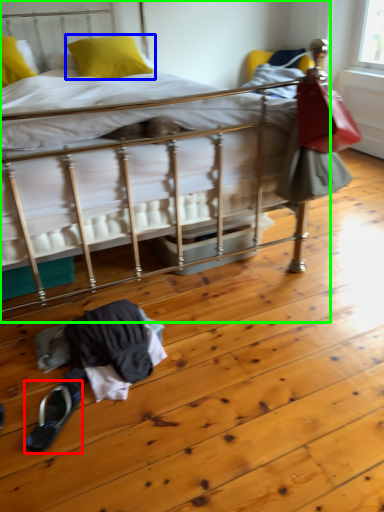
Question: Considering the real-world distances, which object is closest to footwear (highlighted by a red box)? pillow (highlighted by a blue box) or bed (highlighted by a green box).

Choices:
 (A) pillow
 (B) bed

Answer: (A)